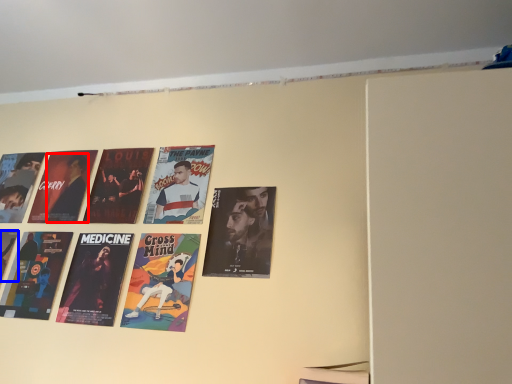
Question: Which point is closer to the camera, person (highlighted by a red box) or poster (highlighted by a blue box)?

Choices:
 (A) person
 (B) poster

Answer: (B)